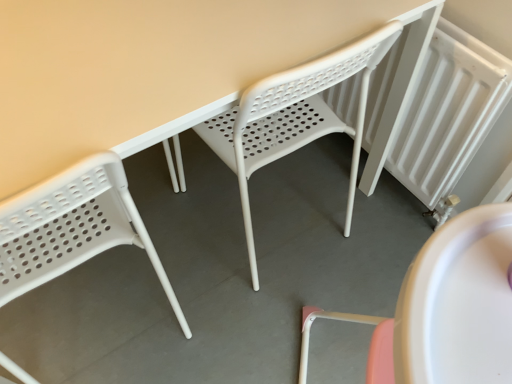
Identify the location of free space between white plastic chair at left, arranged as the 1th chair when viewed from the left, and white plastic chair at center, which appears as the 1th chair when viewed from the right. (192, 260).